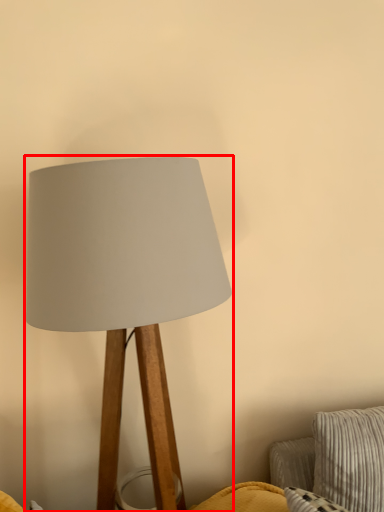
Question: From the image's perspective, where is lamp (annotated by the red box) located in relation to pillow in the image?

Choices:
 (A) above
 (B) below

Answer: (A)